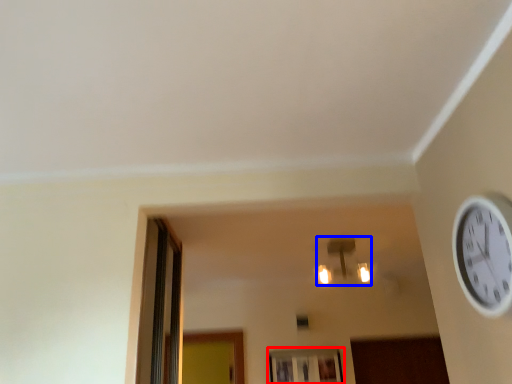
Question: Which point is closer to the camera, window (highlighted by a red box) or light fixture (highlighted by a blue box)?

Choices:
 (A) window
 (B) light fixture

Answer: (B)